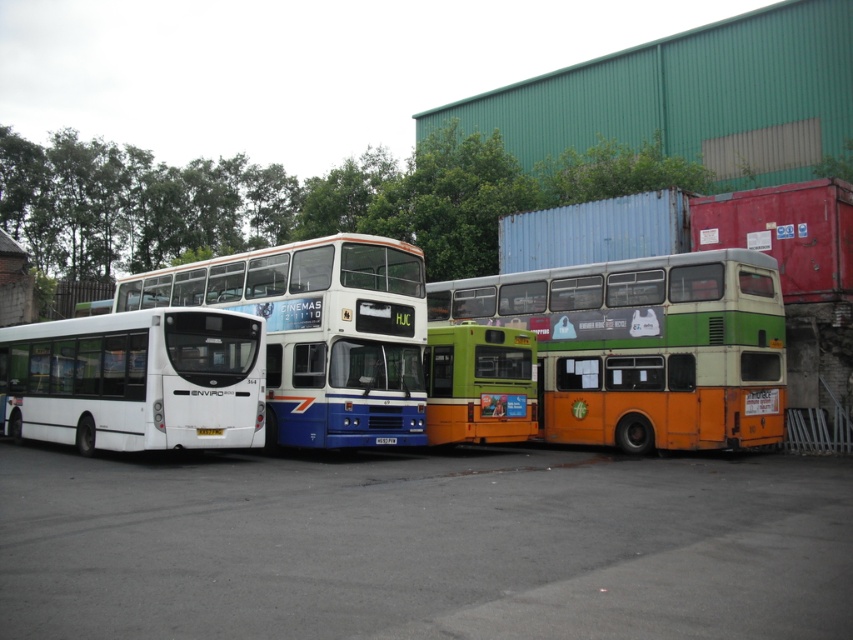
You are a maintenance worker who needs to inspect the buses. You have a ladder that can reach up to 3 meters. The white matte bus at left and the green matte bus at center are both in front of you. Which bus do you think requires the ladder to inspect its roof?

The white matte bus at left has a greater height compared to the green matte bus at center. Since the ladder can reach up to 3 meters, if the white matte bus at left is taller than 3 meters, the ladder would be needed. However, without specific height measurements, it is impossible to determine definitively.

You are standing at the entrance of the storage area and want to walk to the gray asphalt at center. Which direction should you go?

The gray asphalt at center is located at point (422,545), so you should head towards the center of the storage area.